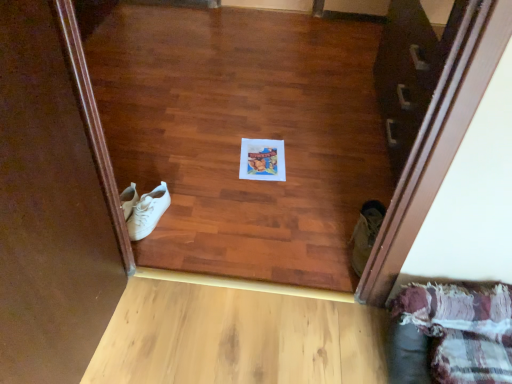
What do you see at coordinates (365, 234) in the screenshot?
I see `tan suede boot at lower right, the second footwear positioned from the left` at bounding box center [365, 234].

In order to face wooden door at center, should I rotate leftwards or rightwards?

To face it directly, rotate right by 21.790 degrees.

I want to click on plaid fabric couch at lower right, so click(x=461, y=329).

Based on the photo, what is the approximate width of light wood plank at lower center?

It is 15.90 inches.

How much space does white leather sneakers at left, acting as the 2th footwear starting from the right, occupy vertically?

white leather sneakers at left, acting as the 2th footwear starting from the right, is 3.43 inches in height.

I want to click on tan suede boot at lower right, the second footwear positioned from the left, so (365, 234).

Is white paper at center bigger than wooden door at center?

Incorrect, white paper at center is not larger than wooden door at center.

From a real-world perspective, relative to wooden door at center, is white paper at center vertically above or below?

From a real-world perspective, white paper at center is physically below wooden door at center.

Is white paper at center at the left side of wooden door at center?

Yes.

Which is less distant, (352, 235) or (211, 356)?

Point (352, 235) is farther from the camera than point (211, 356).

Does tan suede boot at lower right, arranged as the first footwear when viewed from the right, turn towards light wood plank at lower center?

No, tan suede boot at lower right, arranged as the first footwear when viewed from the right, is not oriented towards light wood plank at lower center.

From a real-world perspective, does tan suede boot at lower right, the second footwear positioned from the left, sit lower than light wood plank at lower center?

No, from a real-world perspective, tan suede boot at lower right, the second footwear positioned from the left, is not beneath light wood plank at lower center.

Is light wood plank at lower center oriented away from white leather sneakers at left, placed as the 1th footwear when sorted from left to right?

No.

Is white leather sneakers at left, placed as the 1th footwear when sorted from left to right, completely or partially inside light wood plank at lower center?

No, light wood plank at lower center does not contain white leather sneakers at left, placed as the 1th footwear when sorted from left to right.

Is light wood plank at lower center beside white leather sneakers at left, placed as the 1th footwear when sorted from left to right?

No, light wood plank at lower center is not with white leather sneakers at left, placed as the 1th footwear when sorted from left to right.

From a real-world perspective, is wooden door at center physically below tan suede boot at lower right, arranged as the first footwear when viewed from the right?

No, from a real-world perspective, wooden door at center is not below tan suede boot at lower right, arranged as the first footwear when viewed from the right.

Is tan suede boot at lower right, arranged as the first footwear when viewed from the right, a part of wooden door at center?

No, tan suede boot at lower right, arranged as the first footwear when viewed from the right, is not inside wooden door at center.

You are a GUI agent. You are given a task and a screenshot of the screen. Output one action in this format:
    pyautogui.click(x=<x>, y=<y>)
    Task: Click on the stairwell above the tan suede boot at lower right, the second footwear positioned from the left (from the image's perspective)
    The height and width of the screenshot is (384, 512).
    Given the screenshot: What is the action you would take?
    pyautogui.click(x=411, y=71)

In the scene shown: Considering the relative sizes of wooden door at center and tan suede boot at lower right, the second footwear positioned from the left, in the image provided, is wooden door at center wider than tan suede boot at lower right, the second footwear positioned from the left,?

Incorrect, the width of wooden door at center does not surpass that of tan suede boot at lower right, the second footwear positioned from the left.

Is white paper at center beside light wood plank at lower center?

No, white paper at center is not next to light wood plank at lower center.

Does white paper at center have a lesser width compared to light wood plank at lower center?

Yes, white paper at center is thinner than light wood plank at lower center.

Is white paper at center situated inside light wood plank at lower center or outside?

white paper at center is located beyond the bounds of light wood plank at lower center.

Between white paper at center and light wood plank at lower center, which one appears on the right side from the viewer's perspective?

white paper at center is more to the right.

Considering the points (379, 219) and (453, 348), which point is behind, point (379, 219) or point (453, 348)?

The point (379, 219) is behind.

Is tan suede boot at lower right, the second footwear positioned from the left, next to plaid fabric couch at lower right and touching it?

No, tan suede boot at lower right, the second footwear positioned from the left, is not beside plaid fabric couch at lower right.

Locate an element on the screen. footwear that is the 1st object located above the plaid fabric couch at lower right (from the image's perspective) is located at coordinates (365, 234).

In terms of height, does tan suede boot at lower right, arranged as the first footwear when viewed from the right, look taller or shorter compared to plaid fabric couch at lower right?

Considering their sizes, tan suede boot at lower right, arranged as the first footwear when viewed from the right, has less height than plaid fabric couch at lower right.

In the scene shown: Is white leather sneakers at left, acting as the 2th footwear starting from the right, to the right of plaid fabric couch at lower right from the viewer's perspective?

In fact, white leather sneakers at left, acting as the 2th footwear starting from the right, is to the left of plaid fabric couch at lower right.

From the image's perspective, is white leather sneakers at left, acting as the 2th footwear starting from the right, located beneath plaid fabric couch at lower right?

Actually, white leather sneakers at left, acting as the 2th footwear starting from the right, appears above plaid fabric couch at lower right in the image.

Is there a large distance between white leather sneakers at left, acting as the 2th footwear starting from the right, and plaid fabric couch at lower right?

That's right, there is a large distance between white leather sneakers at left, acting as the 2th footwear starting from the right, and plaid fabric couch at lower right.

Locate an element on the screen. The width and height of the screenshot is (512, 384). copy on the left of wooden door at center is located at coordinates (262, 160).

At what (x,y) coordinates should I click in order to perform the action: click on footwear on the right of the light wood plank at lower center. Please return your answer as a coordinate pair (x, y). This screenshot has height=384, width=512. Looking at the image, I should click on (365, 234).

From the image, which object appears to be nearer to plaid fabric couch at lower right, white paper at center or wooden door at center?

Among the two, wooden door at center is located nearer to plaid fabric couch at lower right.

When comparing their distances from tan suede boot at lower right, arranged as the first footwear when viewed from the right, does white leather sneakers at left, acting as the 2th footwear starting from the right, or white paper at center seem further?

Among the two, white leather sneakers at left, acting as the 2th footwear starting from the right, is located further to tan suede boot at lower right, arranged as the first footwear when viewed from the right.

From the image, which object appears to be farther from wooden door at center, white leather sneakers at left, placed as the 1th footwear when sorted from left to right, or plaid fabric couch at lower right?

Among the two, white leather sneakers at left, placed as the 1th footwear when sorted from left to right, is located further to wooden door at center.

From the image, which object appears to be farther from wooden door at center, plaid fabric couch at lower right or white paper at center?

The object further to wooden door at center is plaid fabric couch at lower right.

Based on their spatial positions, is tan suede boot at lower right, the second footwear positioned from the left, or wooden door at center closer to white leather sneakers at left, placed as the 1th footwear when sorted from left to right?

tan suede boot at lower right, the second footwear positioned from the left, lies closer to white leather sneakers at left, placed as the 1th footwear when sorted from left to right, than the other object.

Which object lies nearer to the anchor point wooden door at center, white paper at center or light wood plank at lower center?

white paper at center is positioned closer to the anchor wooden door at center.

Estimate the real-world distances between objects in this image. Which object is further from wooden door at center, tan suede boot at lower right, the second footwear positioned from the left, or light wood plank at lower center?

Among the two, light wood plank at lower center is located further to wooden door at center.

Considering their positions, is light wood plank at lower center positioned closer to white paper at center than wooden door at center?

wooden door at center.

Find the location of a particular element. This screenshot has width=512, height=384. plank between white leather sneakers at left, acting as the 2th footwear starting from the right, and wooden door at center, in the horizontal direction is located at coordinates (236, 334).

Locate an element on the screen. The width and height of the screenshot is (512, 384). plank between white leather sneakers at left, placed as the 1th footwear when sorted from left to right, and plaid fabric couch at lower right is located at coordinates (236, 334).

Where is `copy that lies between wooden door at center and plaid fabric couch at lower right from top to bottom`? The width and height of the screenshot is (512, 384). copy that lies between wooden door at center and plaid fabric couch at lower right from top to bottom is located at coordinates (262, 160).

At what (x,y) coordinates should I click in order to perform the action: click on copy between white leather sneakers at left, acting as the 2th footwear starting from the right, and wooden door at center, in the horizontal direction. Please return your answer as a coordinate pair (x, y). This screenshot has height=384, width=512. Looking at the image, I should click on (262, 160).